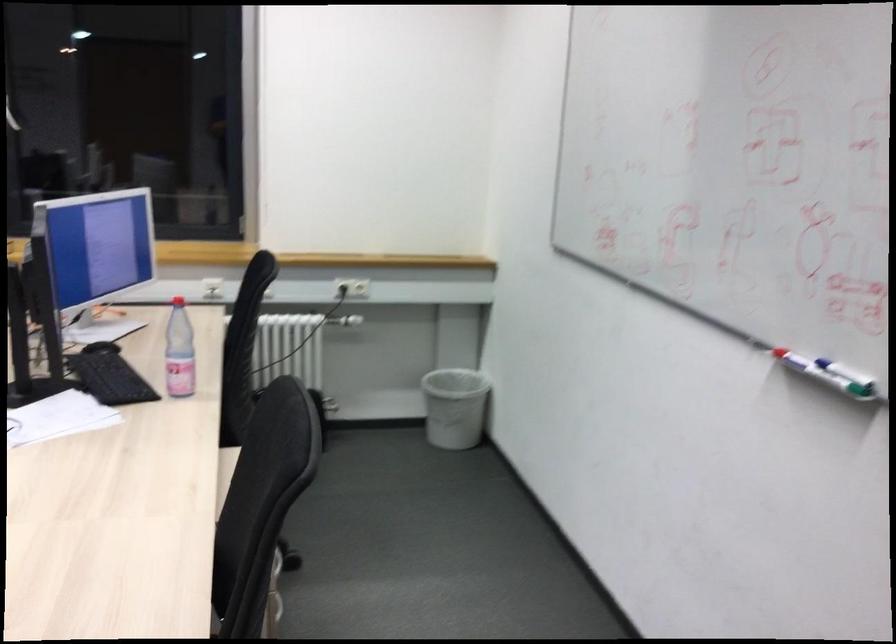
Where would you lift the white trash can? Please return your answer as a coordinate pair (x, y).

(454, 406)